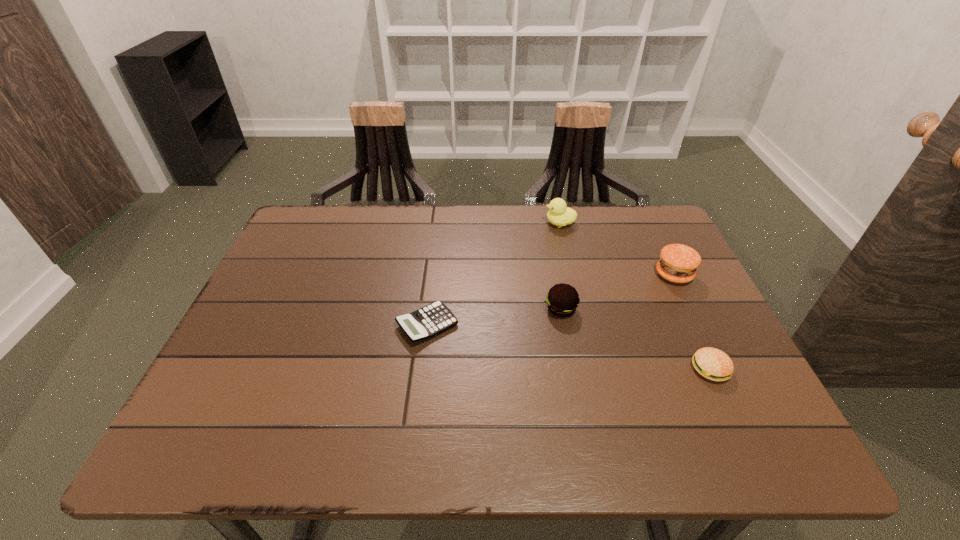
At what (x,y) coordinates should I click in order to perform the action: click on duckling. Please return your answer as a coordinate pair (x, y). The image size is (960, 540). Looking at the image, I should click on (559, 214).

What are the coordinates of `the fourth nearest object` in the screenshot? It's located at (678, 263).

In order to click on the tallest patty in this screenshot , I will do `click(678, 263)`.

You are a GUI agent. You are given a task and a screenshot of the screen. Output one action in this format:
    pyautogui.click(x=<x>, y=<y>)
    Task: Click on the leftmost patty
    
    Given the screenshot: What is the action you would take?
    pyautogui.click(x=562, y=300)

Where is `the second nearest patty`? This screenshot has width=960, height=540. the second nearest patty is located at coordinates (562, 300).

Identify the location of the shortest patty. The height and width of the screenshot is (540, 960). (713, 364).

This screenshot has width=960, height=540. In order to click on the fourth tallest object in this screenshot , I will do `click(713, 364)`.

Where is `calculator`? This screenshot has width=960, height=540. calculator is located at coordinates (428, 321).

Find the location of a particular element. The image size is (960, 540). the leftmost object is located at coordinates (428, 321).

You are a GUI agent. You are given a task and a screenshot of the screen. Output one action in this format:
    pyautogui.click(x=<x>, y=<y>)
    Task: Click on the free space located at the beak of the duckling
    This screenshot has width=960, height=540.
    Given the screenshot: What is the action you would take?
    pyautogui.click(x=516, y=223)